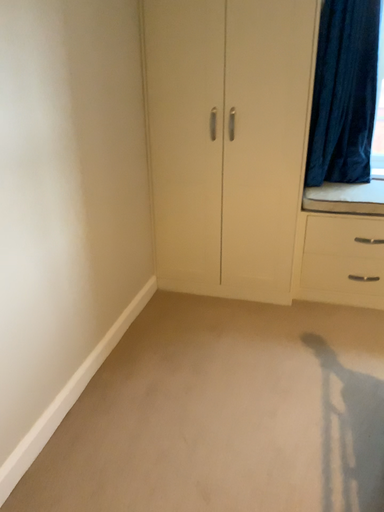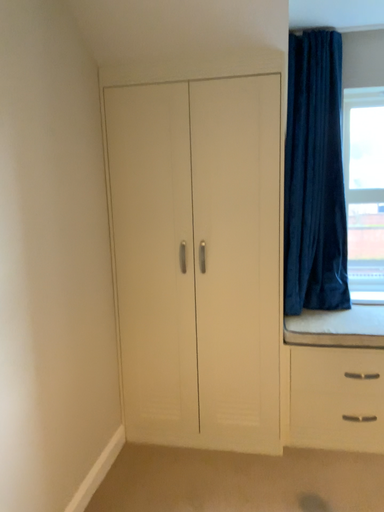
Question: How did the camera likely rotate when shooting the video?

Choices:
 (A) rotated upward
 (B) rotated downward

Answer: (A)